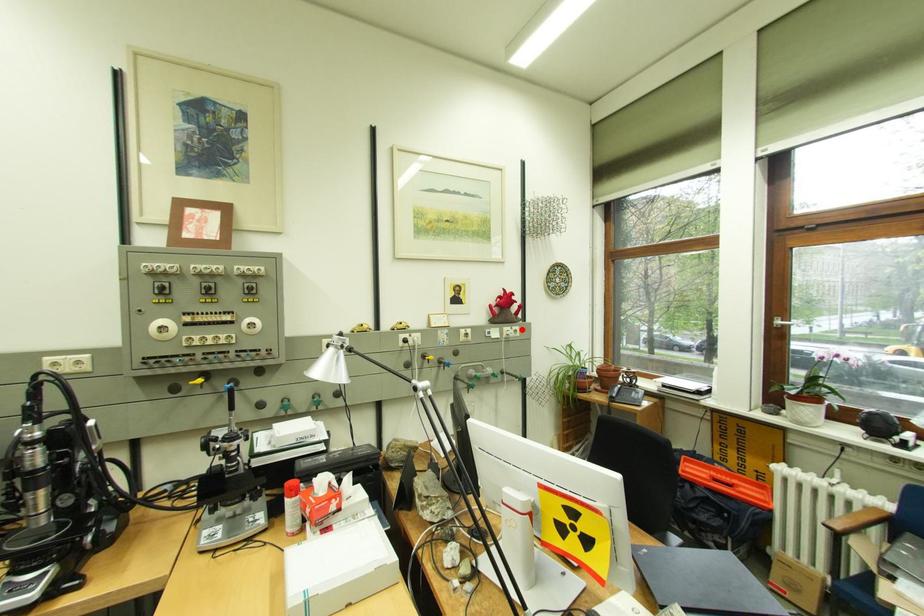
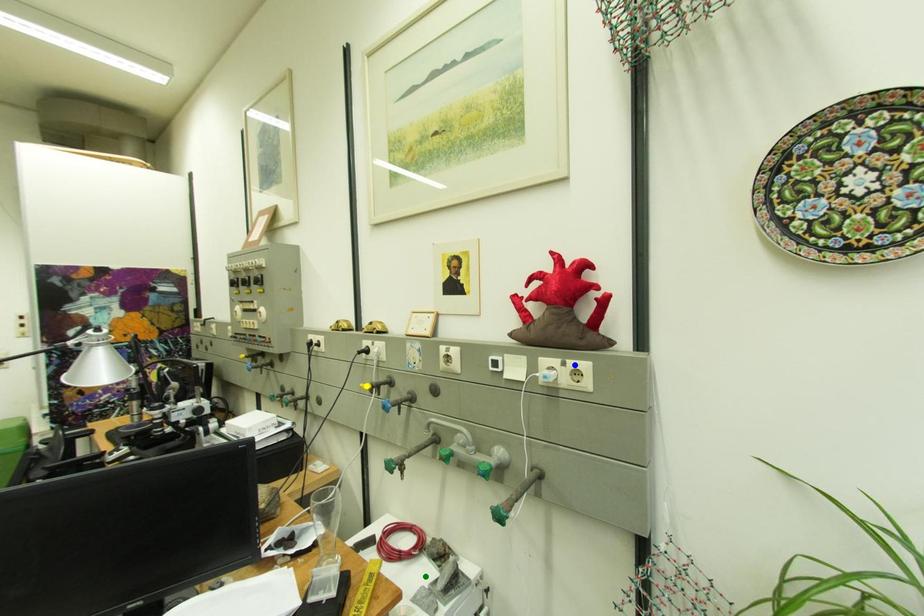
Question: I am providing you with two images of the same scene from different viewpoints. A red point is marked on the first image. You are given multiple points on the second image. Can you choose the point in image 2 that corresponds to the point in image 1?

Choices:
 (A) yellow point
 (B) blue point
 (C) green point

Answer: (B)